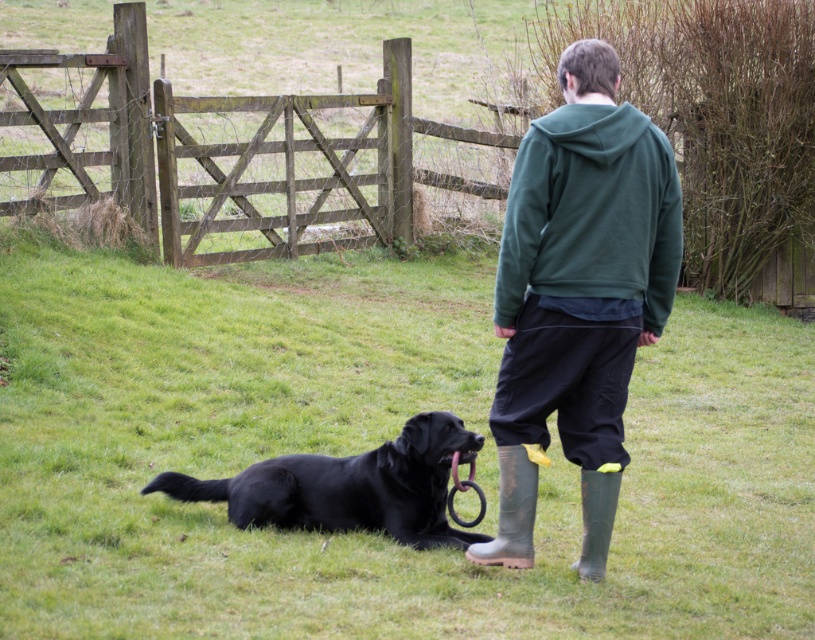
Question: Which point appears farthest from the camera in this image?

Choices:
 (A) (716, 148)
 (B) (523, 544)
 (C) (668, 301)

Answer: (A)

Question: Is green fleece sweatshirt at upper center wider than green rubber boot at lower right?

Choices:
 (A) no
 (B) yes

Answer: (B)

Question: Among these objects, which one is nearest to the camera?

Choices:
 (A) green fleece sweatshirt at upper center
 (B) rubber/muddy boot at lower center

Answer: (A)

Question: Is wooden gate at center wider than rubber/muddy boot at lower center?

Choices:
 (A) yes
 (B) no

Answer: (A)

Question: Among these objects, which one is farthest from the camera?

Choices:
 (A) wooden gate at center
 (B) green fleece sweatshirt at upper center
 (C) green matte hoodie at center
 (D) shiny black dog at center

Answer: (D)

Question: Can you confirm if shiny black dog at center is smaller than rubber/muddy boot at lower center?

Choices:
 (A) yes
 (B) no

Answer: (B)